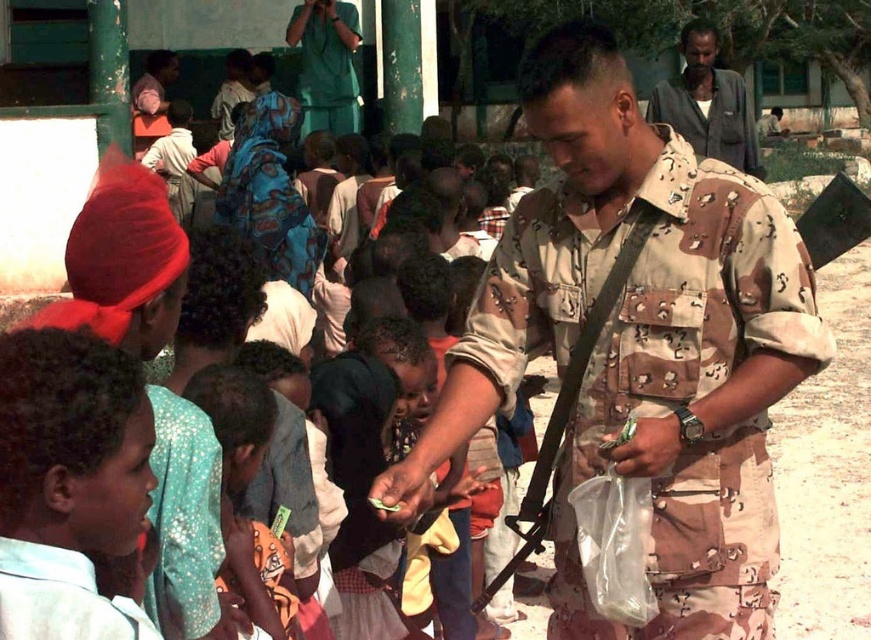
Is light blue shirt at lower left above dark gray shirt at upper right?

No, light blue shirt at lower left is not above dark gray shirt at upper right.

Can you confirm if light blue shirt at lower left is wider than dark gray shirt at upper right?

No, light blue shirt at lower left is not wider than dark gray shirt at upper right.

Is point (113, 419) closer to camera compared to point (706, 118)?

Yes, point (113, 419) is closer to viewer.

Where is `light blue shirt at lower left`? This screenshot has height=640, width=871. light blue shirt at lower left is located at coordinates (69, 483).

Who is positioned more to the right, orange fabric dress at center or light blue fabric shirt at lower left?

Positioned to the right is orange fabric dress at center.

Is point (255, 406) closer to camera compared to point (52, 572)?

No, it is not.

Is point (273, 563) farther from camera compared to point (28, 602)?

Yes, point (273, 563) is farther from viewer.

Locate an element on the screen. orange fabric dress at center is located at coordinates (242, 490).

Can you confirm if light blue fabric shirt at lower left is shorter than green uniform at upper center?

Yes.

Who is lower down, light blue fabric shirt at lower left or green uniform at upper center?

light blue fabric shirt at lower left is below.

This screenshot has width=871, height=640. I want to click on light blue fabric shirt at lower left, so click(59, 596).

In order to click on light blue fabric shirt at lower left in this screenshot , I will do `click(59, 596)`.